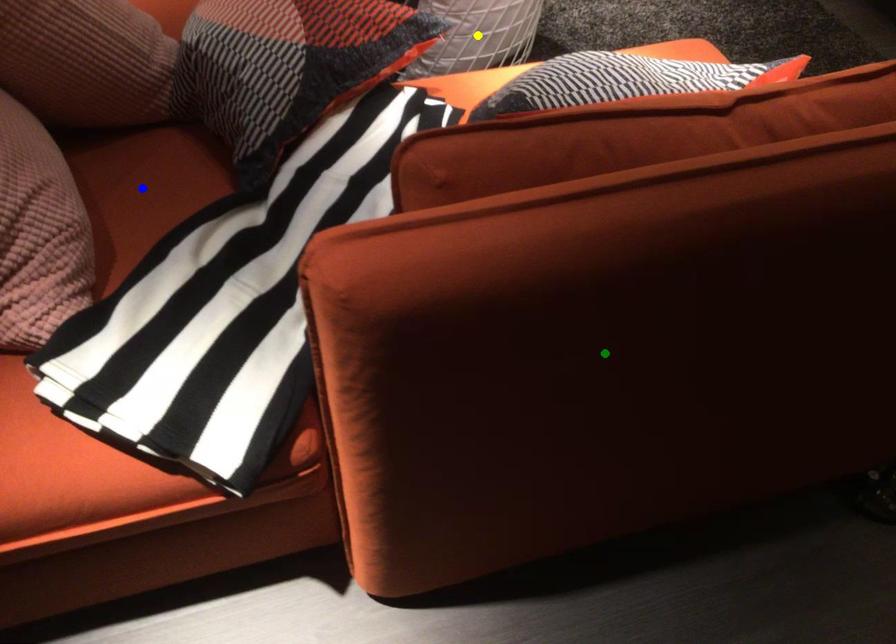
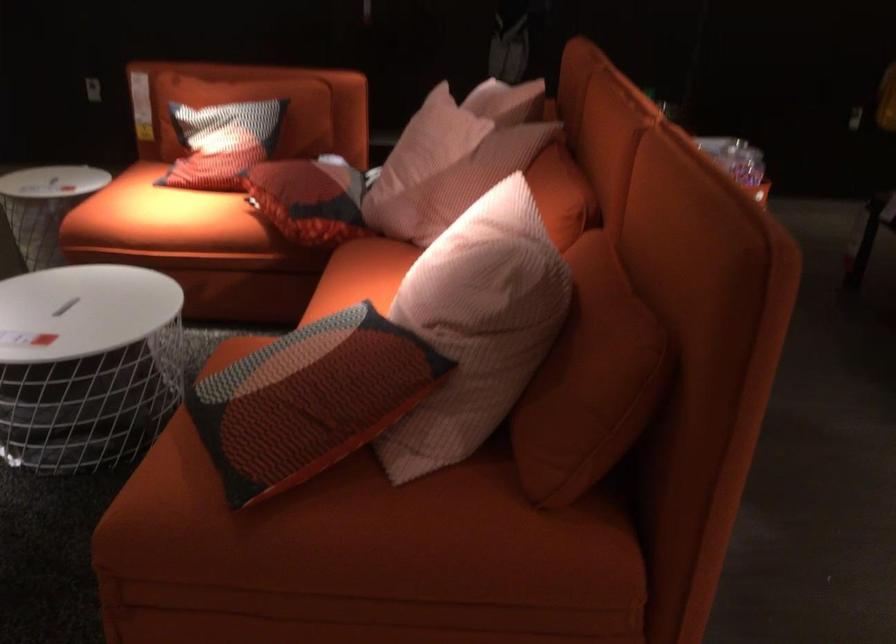
I am providing you with two images of the same scene from different viewpoints. Three points are marked in image1. Which point corresponds to a part or object that is occluded in image2?In image1, three points are marked. Which of them correspond to a part or object that is occluded in image2?Among the three points shown in image1, which one corresponds to a part or object that is no longer visible due to occlusion in image2?

green point, yellow point, blue point